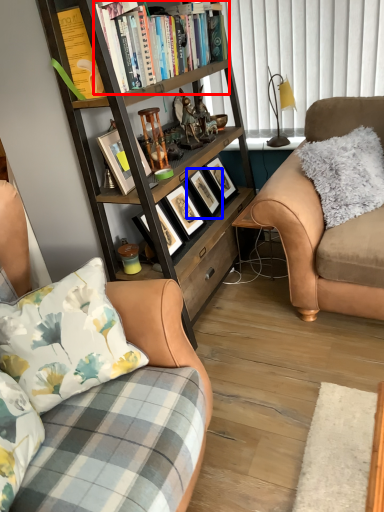
Question: Among these objects, which one is nearest to the camera, book (highlighted by a red box) or picture frame (highlighted by a blue box)?

Choices:
 (A) book
 (B) picture frame

Answer: (A)